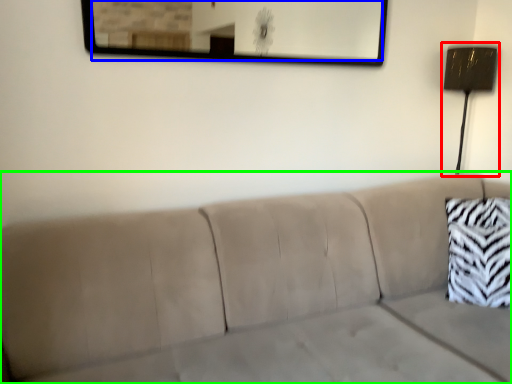
Question: Considering the real-world distances, which object is farthest from lamp (highlighted by a red box)? mirror (highlighted by a blue box) or studio couch (highlighted by a green box)?

Choices:
 (A) mirror
 (B) studio couch

Answer: (A)